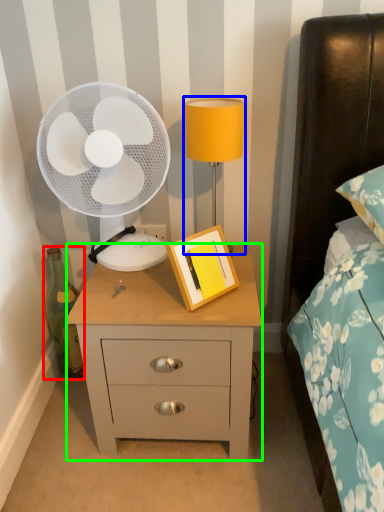
Question: Estimate the real-world distances between objects in this image. Which object is farther from bottle (highlighted by a red box), bedside lamp (highlighted by a blue box) or nightstand (highlighted by a green box)?

Choices:
 (A) bedside lamp
 (B) nightstand

Answer: (A)